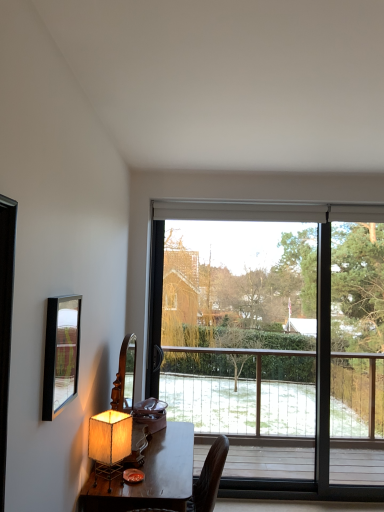
In order to click on vacant area on the back side of matte beige lampshade at lower left in this screenshot , I will do `click(132, 470)`.